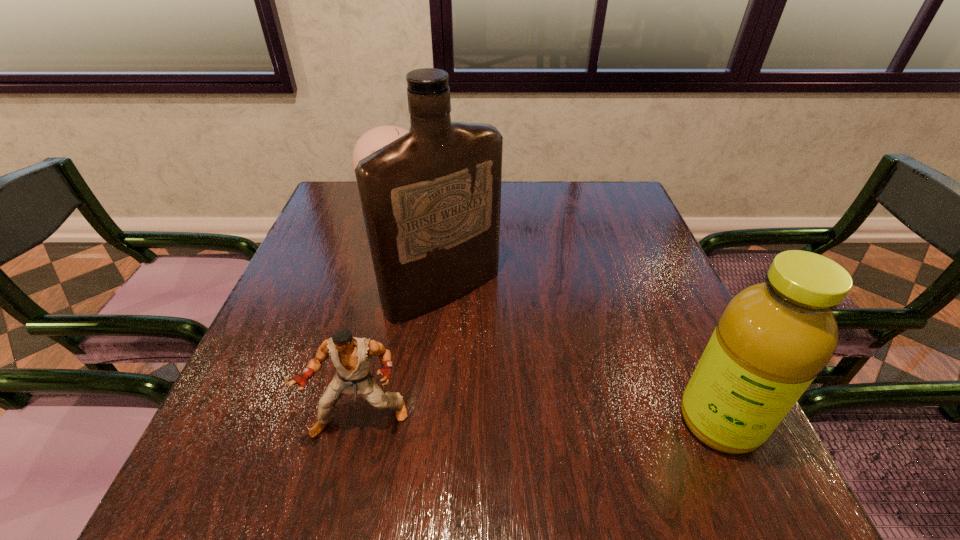
Image resolution: width=960 pixels, height=540 pixels. Identify the location of free space at the left edge. (341, 321).

Find the location of a particular element. The image size is (960, 540). vacant region at the right edge of the desktop is located at coordinates (644, 316).

This screenshot has height=540, width=960. In the image, there is a desktop. Identify the location of free region at the far right corner. (586, 201).

Identify the location of vacant space that is in between the third nearest object and the puncher. This screenshot has height=540, width=960. point(402,355).

At what (x,y) coordinates should I click in order to perform the action: click on free space between the second tallest object and the second farthest object. Please return your answer as a coordinate pair (x, y). This screenshot has width=960, height=540. Looking at the image, I should click on pyautogui.click(x=581, y=356).

Identify the location of empty space between the puncher and the farthest object. (378, 311).

Locate an element on the screen. vacant space that is in between the rightmost object and the puncher is located at coordinates (540, 421).

Find the location of a particular element. The width and height of the screenshot is (960, 540). vacant area between the piggy bank and the puncher is located at coordinates (378, 311).

This screenshot has height=540, width=960. Find the location of `vacant area that lies between the puncher and the piggy bank`. vacant area that lies between the puncher and the piggy bank is located at coordinates (378, 311).

Image resolution: width=960 pixels, height=540 pixels. Identify the location of vacant area that lies between the tallest object and the third shortest object. (581, 356).